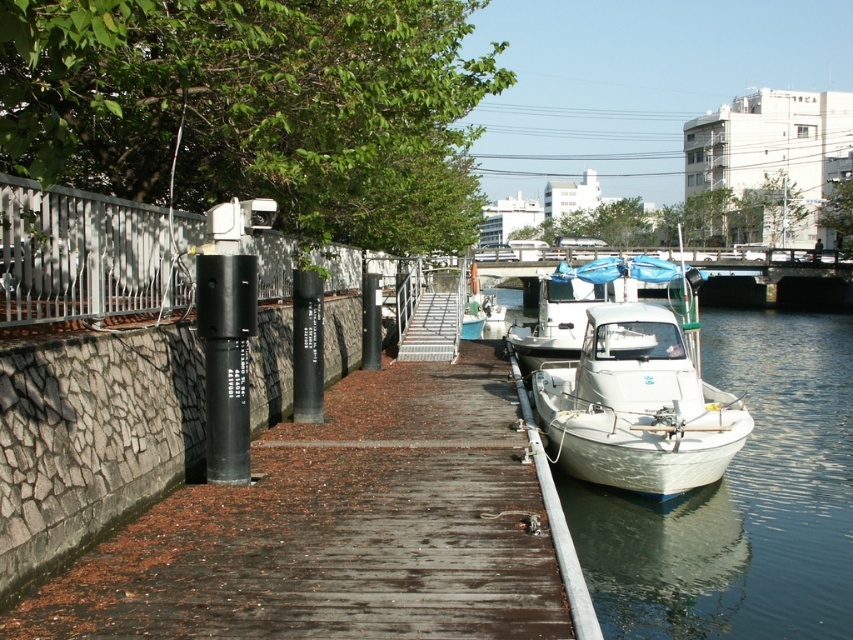
You are standing at the point with coordinates point (x=631, y=298) and want to walk towards the point with coordinates point (x=561, y=410). Which direction should you move relative to your current position?

You should move forward because point (x=561, y=410) is in front of point (x=631, y=298).

You are standing at the edge of the wooden walkway in the waterfront scene. There are two points marked in the image. Which point, point (38, 586) or point (676, 556), is closer to you?

Point (38, 586) is closer to you than point (676, 556).